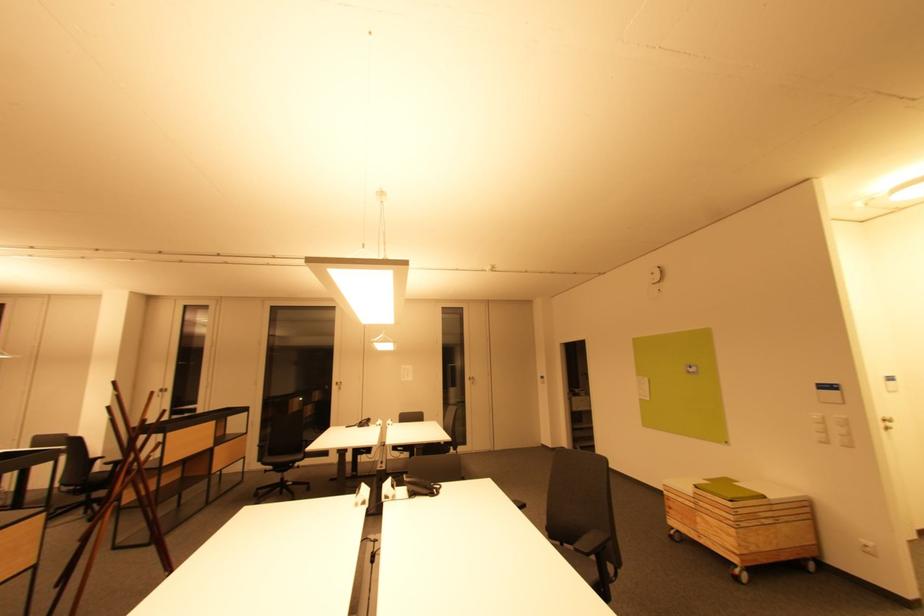
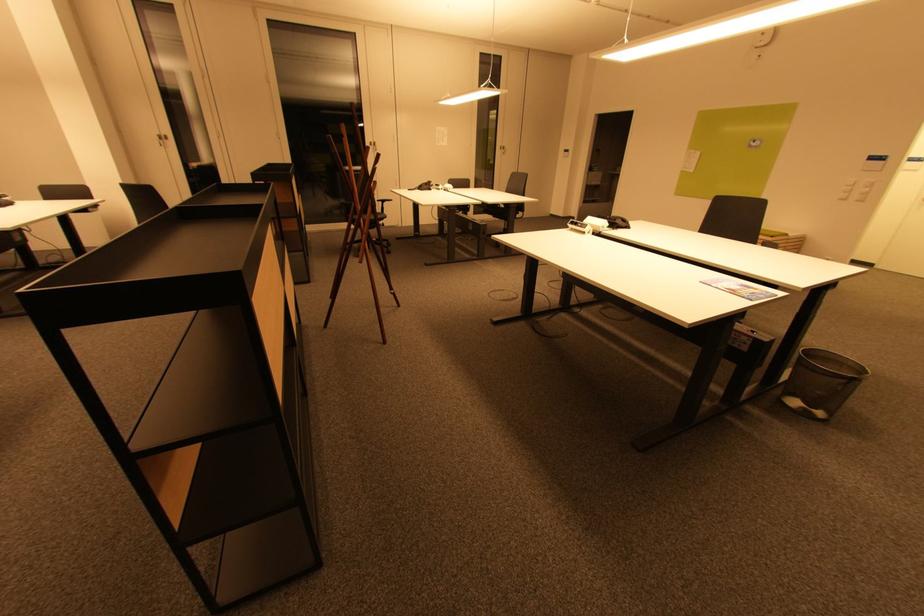
Find the pixel in the second image that matches point (734, 498) in the first image.

(775, 236)